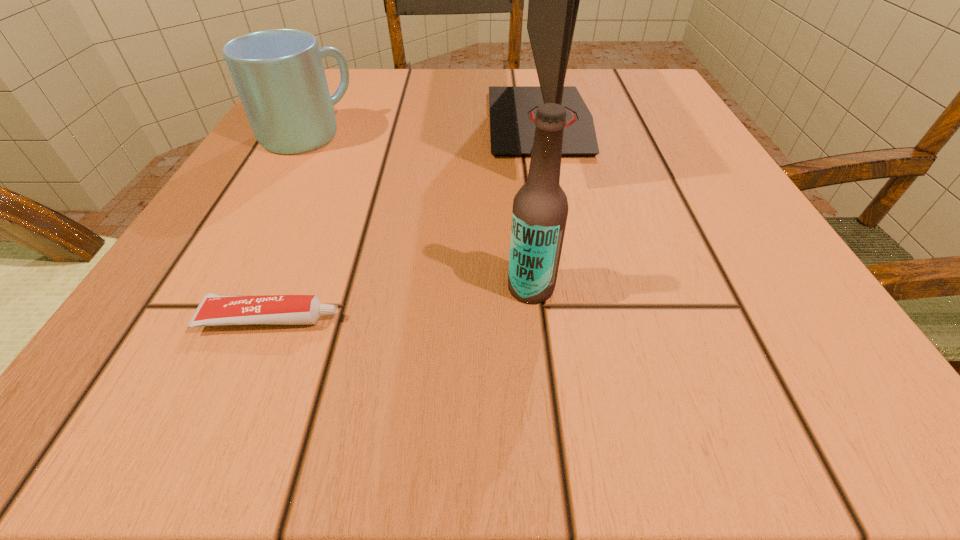
The width and height of the screenshot is (960, 540). I want to click on free space located 0.220m on the right of the second shortest object, so click(479, 135).

I want to click on free region located 0.180m at the nozzle of the toothpaste, so click(x=505, y=319).

The height and width of the screenshot is (540, 960). Identify the location of monitor at the far edge. (554, 0).

Where is `mug that is at the far edge`? mug that is at the far edge is located at coordinates (279, 75).

Locate an element on the screen. mug at the left edge is located at coordinates (279, 75).

Where is `toothpaste situated at the left edge`? This screenshot has width=960, height=540. toothpaste situated at the left edge is located at coordinates (214, 309).

The height and width of the screenshot is (540, 960). I want to click on object located at the far left corner, so click(279, 75).

Where is `free point at the far edge`? free point at the far edge is located at coordinates (437, 85).

Identify the location of blank space at the near edge. The image size is (960, 540). pyautogui.click(x=488, y=419).

At what (x,y) coordinates should I click in order to perform the action: click on vacant space at the left edge. Please return your answer as a coordinate pair (x, y). The image size is (960, 540). Looking at the image, I should click on pyautogui.click(x=210, y=254).